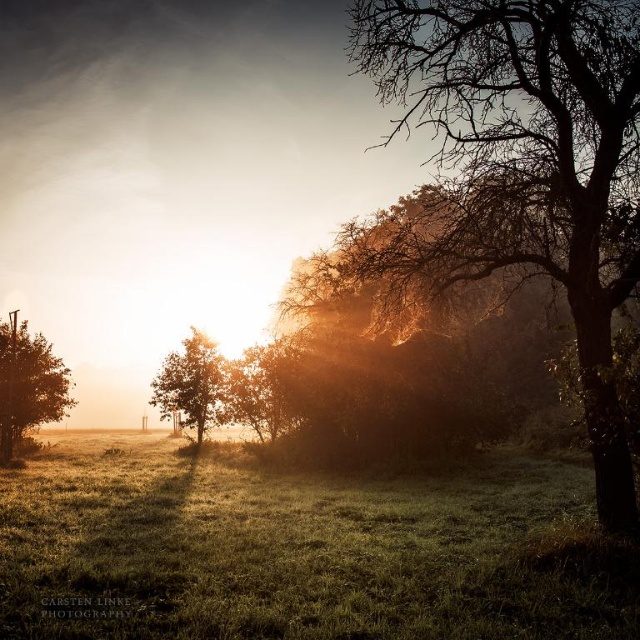
Is green grassy at lower center behind green matte tree at left?

No, it is in front of green matte tree at left.

Does green grassy at lower center come in front of green matte tree at left?

Yes.

Between point (193, 572) and point (13, 400), which one is positioned behind?

The point (13, 400) is behind.

Locate an element on the screen. Image resolution: width=640 pixels, height=640 pixels. green grassy at lower center is located at coordinates (289, 552).

Is green matte tree at left to the right of green matte tree at center from the viewer's perspective?

Incorrect, green matte tree at left is not on the right side of green matte tree at center.

Which of these two, green matte tree at left or green matte tree at center, stands taller?

With more height is green matte tree at left.

At what (x,y) coordinates should I click in order to perform the action: click on green matte tree at left. Please return your answer as a coordinate pair (x, y). Looking at the image, I should click on (28, 384).

Which of these two, brown textured tree at right or green matte tree at center, stands shorter?

green matte tree at center

You are a GUI agent. You are given a task and a screenshot of the screen. Output one action in this format:
    pyautogui.click(x=<x>, y=<y>)
    Task: Click on the brown textured tree at right
    The width and height of the screenshot is (640, 640).
    Given the screenshot: What is the action you would take?
    pyautogui.click(x=528, y=164)

Does point (540, 202) come behind point (177, 403)?

No, it is not.

Locate an element on the screen. Image resolution: width=640 pixels, height=640 pixels. brown textured tree at right is located at coordinates (528, 164).